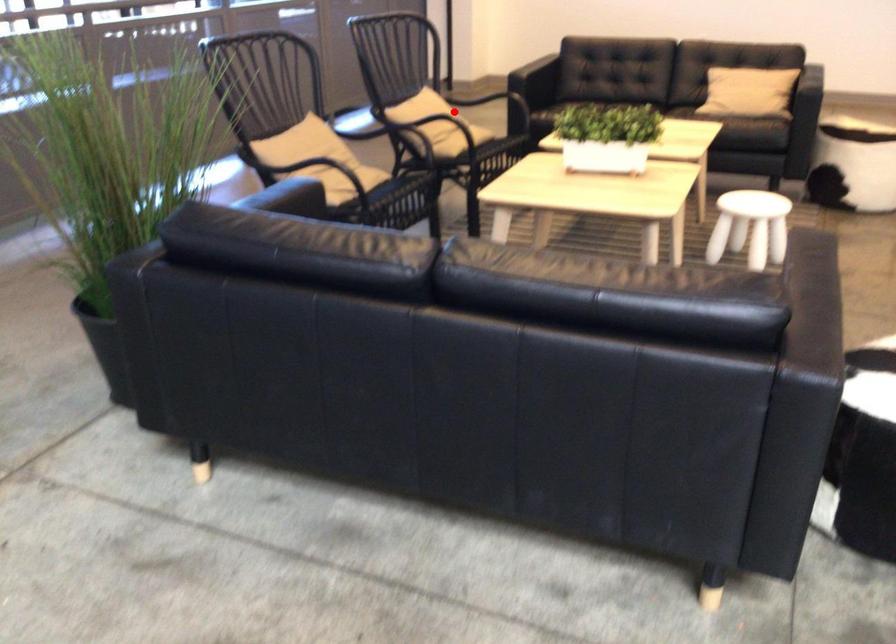
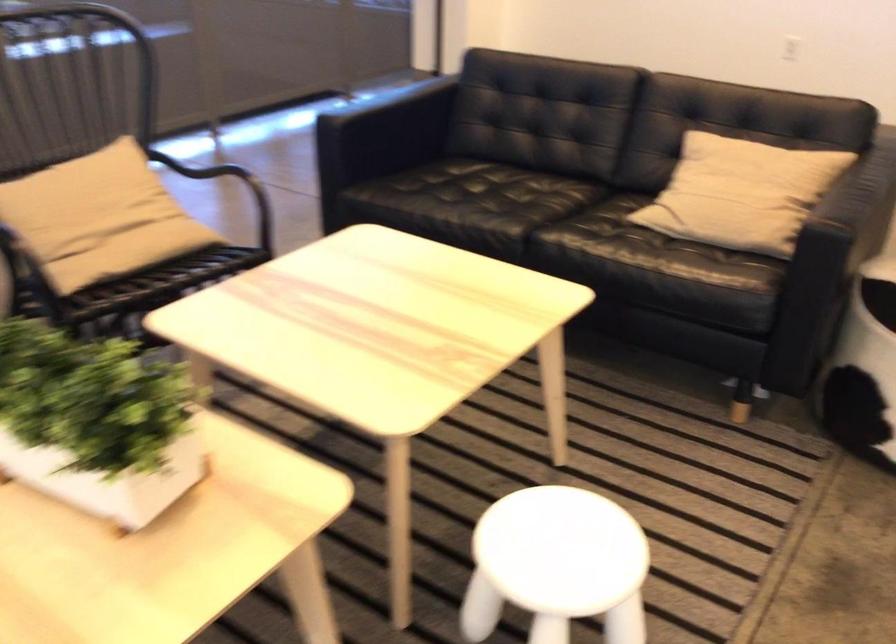
Question: A red point is marked in image1. In image2, is the corresponding 3D point closer to the camera or farther? Reply with the corresponding letter.

Choices:
 (A) The corresponding 3D point is closer.
 (B) The corresponding 3D point is farther.

Answer: (A)